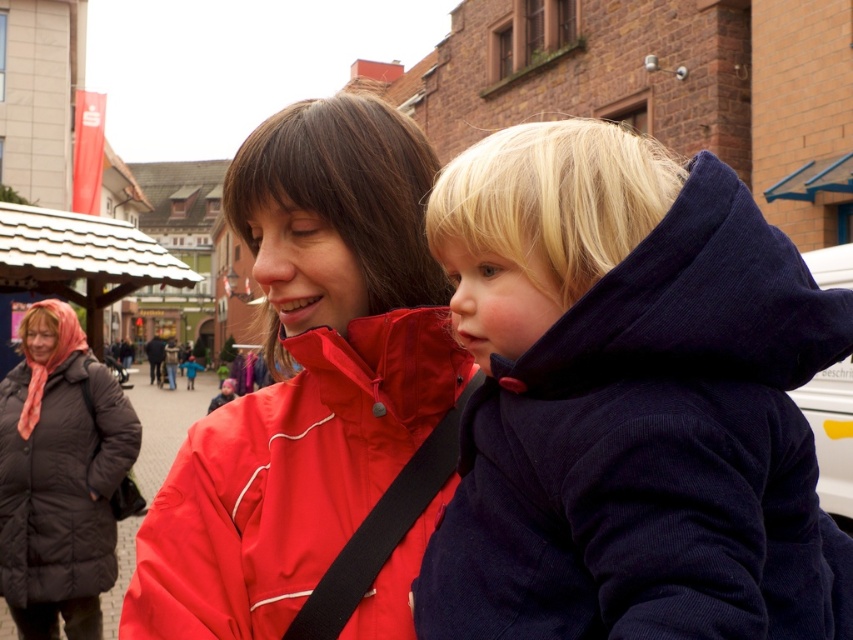
Can you confirm if matte red jacket at center is positioned to the left of black puffy coat at lower left?

No, matte red jacket at center is not to the left of black puffy coat at lower left.

You are a GUI agent. You are given a task and a screenshot of the screen. Output one action in this format:
    pyautogui.click(x=<x>, y=<y>)
    Task: Click on the matte red jacket at center
    
    Given the screenshot: What is the action you would take?
    pyautogui.click(x=285, y=477)

Which is more to the right, navy corduroy jacket at center or black puffy coat at lower left?

navy corduroy jacket at center

Is navy corduroy jacket at center above black puffy coat at lower left?

Yes.

Locate an element on the screen. This screenshot has width=853, height=640. navy corduroy jacket at center is located at coordinates (630, 401).

Find the location of a particular element. This screenshot has width=853, height=640. navy corduroy jacket at center is located at coordinates (630, 401).

Is point (827, 349) farther from camera compared to point (206, 500)?

No, (827, 349) is closer to viewer.

Is point (494, 515) positioned before point (189, 595)?

Yes, point (494, 515) is in front of point (189, 595).

What do you see at coordinates (630, 401) in the screenshot? I see `navy corduroy jacket at center` at bounding box center [630, 401].

You are a GUI agent. You are given a task and a screenshot of the screen. Output one action in this format:
    pyautogui.click(x=<x>, y=<y>)
    Task: Click on the navy corduroy jacket at center
    This screenshot has height=640, width=853.
    Given the screenshot: What is the action you would take?
    pyautogui.click(x=630, y=401)